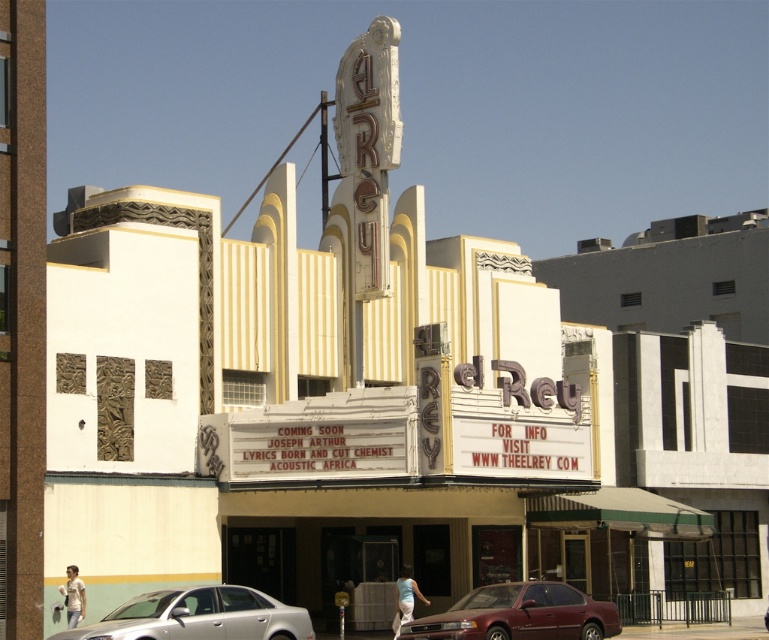
structural integrity is a concern for a delivery truck that is 40 meters long. you are standing in front of the theater and see the silver metallic sedan at lower center. can the delivery truck pass by the theater without hitting the sedan?

The silver metallic sedan at lower center is 38.67 meters away from viewer. Since the delivery truck is 40 meters long, it cannot safely pass by the theater without risking collision with the sedan.

You are a parking attendant who needs to fit a new car that is 1.5 meters tall into the available space between two other cars. You see the silver metallic sedan at lower center and the maroon metallic sedan at lower center. Which car should you position the new car next to to ensure it fits vertically?

The silver metallic sedan at lower center has a lesser height compared to the maroon metallic sedan at lower center. Therefore, positioning the new car next to the silver metallic sedan at lower center would provide sufficient vertical clearance since it is shorter.

You are a valet parking attendant at the El Rey theater. You need to park a car that is exactly 1.8 meters wide. You see a silver metallic sedan at lower center and a white cotton shirt at lower center. Which object should you consider when determining the available space for parking the car?

The silver metallic sedan at lower center might be wider than the white cotton shirt at lower center, so you should consider the silver metallic sedan at lower center when determining the available space for parking the car since its width could affect the parking space requirements.